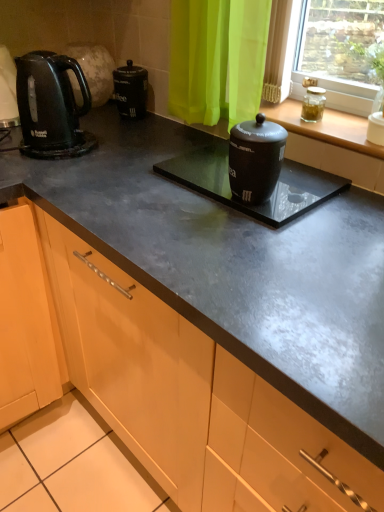
Question: From the image's perspective, is clear glass jar at upper right, the 2th appliance in the bottom-to-top sequence, located above or below black matte canister at center, the 2th appliance from the top?

Choices:
 (A) above
 (B) below

Answer: (A)

Question: Is clear glass jar at upper right, which ranks as the 1th appliance in top-to-bottom order, inside the boundaries of black matte canister at center, the 2th appliance from the top, or outside?

Choices:
 (A) inside
 (B) outside

Answer: (B)

Question: Estimate the real-world distances between objects in this image. Which object is farther from the clear glass jar at upper right?

Choices:
 (A) matte black kettle at left
 (B) transparent glass jar at upper right
 (C) clear glass jar at upper right, which ranks as the 1th appliance in top-to-bottom order
 (D) black matte canister at center, which ranks as the 1th appliance in bottom-to-top order

Answer: (A)

Question: Which is farther from the transparent glass jar at upper right?

Choices:
 (A) clear glass jar at upper right
 (B) black matte canister at center, the 2th appliance from the top
 (C) clear glass jar at upper right, the 2th appliance in the bottom-to-top sequence
 (D) matte black kettle at left

Answer: (D)